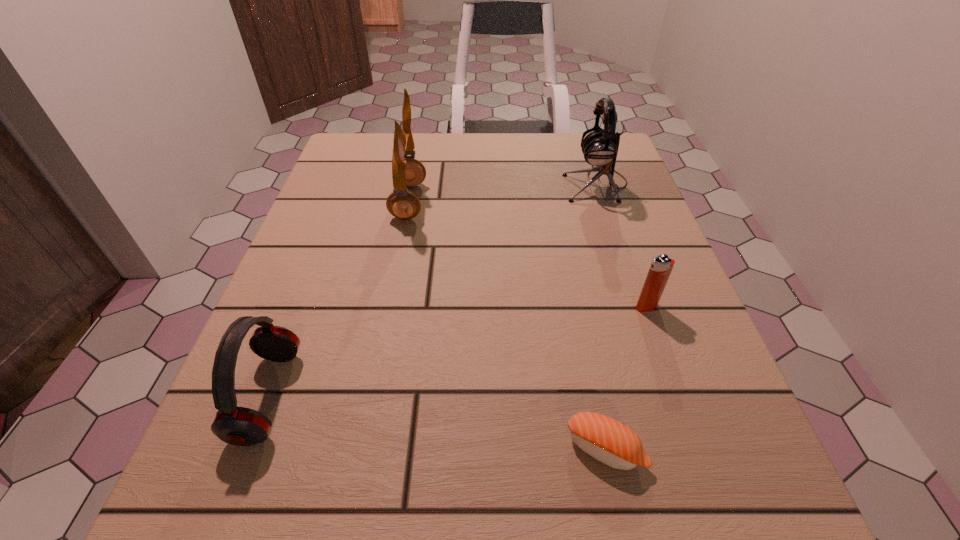
In order to click on unoccupied position between the sushi and the second object from left to right in this screenshot , I will do `click(507, 325)`.

Identify the location of vacant space that's between the rightmost earphone and the shortest object. The width and height of the screenshot is (960, 540). (601, 316).

Select which object is the closest to the shortest earphone. Please provide its 2D coordinates. Your answer should be formatted as a tuple, i.e. [(x, y)], where the tuple contains the x and y coordinates of a point satisfying the conditions above.

[(406, 171)]

Identify which object is located as the fourth nearest to the shortest earphone. Please provide its 2D coordinates. Your answer should be formatted as a tuple, i.e. [(x, y)], where the tuple contains the x and y coordinates of a point satisfying the conditions above.

[(600, 148)]

Locate an element on the screen. The image size is (960, 540). earphone that can be found as the second closest to the rightmost earphone is located at coordinates (240, 426).

Where is `earphone that is the closest to the fourth object from right to left`? earphone that is the closest to the fourth object from right to left is located at coordinates [x=240, y=426].

Identify the location of blank space that satisfies the following two spatial constraints: 1. on the front-facing side of the second object from left to right; 2. on the back side of the third nearest object. The width and height of the screenshot is (960, 540). (389, 307).

Identify the location of free space that satisfies the following two spatial constraints: 1. on the ear cups of the leftmost earphone; 2. on the back side of the sushi. (249, 449).

Where is `free space in the image that satisfies the following two spatial constraints: 1. on the front side of the second shortest object; 2. on the ear cups of the leftmost object`? free space in the image that satisfies the following two spatial constraints: 1. on the front side of the second shortest object; 2. on the ear cups of the leftmost object is located at coordinates (678, 396).

This screenshot has height=540, width=960. What are the coordinates of `vacant point that satisfies the following two spatial constraints: 1. on the ear cups of the nearest earphone; 2. on the right side of the sushi` in the screenshot? It's located at (249, 449).